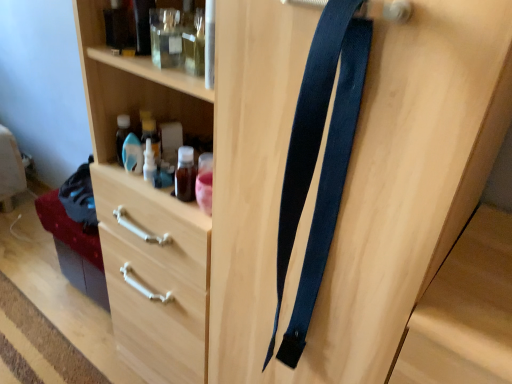
Question: Can you confirm if wooden drawer at lower left is taller than transparent plastic bottle at upper center?

Choices:
 (A) no
 (B) yes

Answer: (A)

Question: Is the depth of wooden drawer at lower left less than that of transparent plastic bottle at upper center?

Choices:
 (A) yes
 (B) no

Answer: (B)

Question: Is transparent plastic bottle at upper center at the back of wooden drawer at lower left?

Choices:
 (A) no
 (B) yes

Answer: (A)

Question: Does wooden drawer at lower left have a larger size compared to transparent plastic bottle at upper center?

Choices:
 (A) no
 (B) yes

Answer: (B)

Question: From a real-world perspective, is wooden drawer at lower left over transparent plastic bottle at upper center?

Choices:
 (A) no
 (B) yes

Answer: (A)

Question: Would you consider wooden drawer at lower left to be distant from transparent plastic bottle at upper center?

Choices:
 (A) no
 (B) yes

Answer: (A)

Question: Does dark blue fabric suspenders at center appear on the right side of transparent plastic bottle at upper center?

Choices:
 (A) yes
 (B) no

Answer: (A)

Question: From the image's perspective, is dark blue fabric suspenders at center below transparent plastic bottle at upper center?

Choices:
 (A) no
 (B) yes

Answer: (B)

Question: From a real-world perspective, is dark blue fabric suspenders at center beneath transparent plastic bottle at upper center?

Choices:
 (A) no
 (B) yes

Answer: (A)

Question: Does dark blue fabric suspenders at center have a lesser width compared to transparent plastic bottle at upper center?

Choices:
 (A) no
 (B) yes

Answer: (A)

Question: Can you confirm if dark blue fabric suspenders at center is bigger than transparent plastic bottle at upper center?

Choices:
 (A) yes
 (B) no

Answer: (A)

Question: Does dark blue fabric suspenders at center have a lesser height compared to transparent plastic bottle at upper center?

Choices:
 (A) yes
 (B) no

Answer: (B)

Question: Is dark blue fabric suspenders at center to the right of wooden drawer at lower left from the viewer's perspective?

Choices:
 (A) no
 (B) yes

Answer: (B)